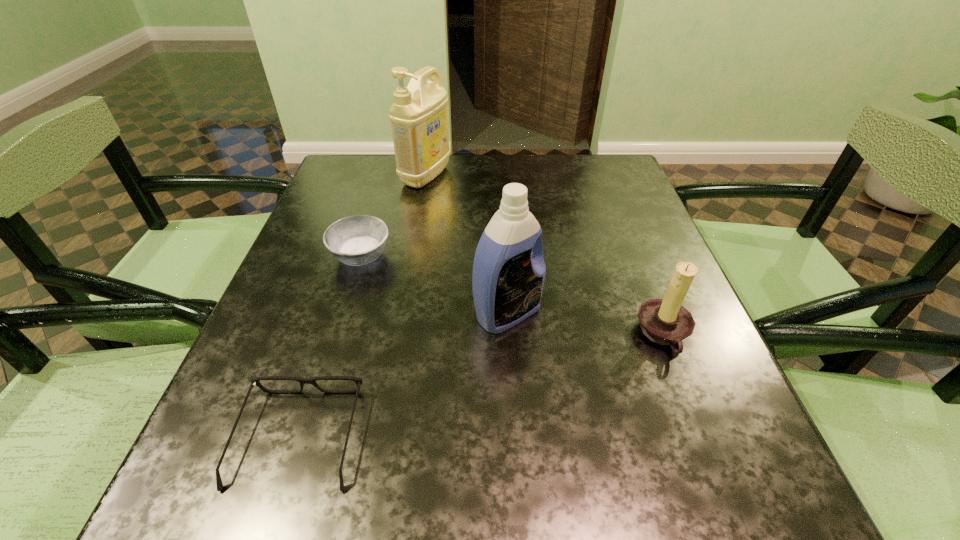
Identify the location of free spot located on the front of the farther detergent. The width and height of the screenshot is (960, 540). (404, 301).

Locate an element on the screen. The image size is (960, 540). free space located 0.070m on the front of the fourth object from left to right is located at coordinates (x=512, y=370).

Where is `vacant space located on the wick of the third tallest object`? This screenshot has width=960, height=540. vacant space located on the wick of the third tallest object is located at coordinates (604, 335).

Identify the location of vacant region located on the wick of the third tallest object. This screenshot has height=540, width=960. (412, 335).

Where is `free point located on the wick of the third tallest object`? This screenshot has width=960, height=540. free point located on the wick of the third tallest object is located at coordinates (559, 335).

You are a GUI agent. You are given a task and a screenshot of the screen. Output one action in this format:
    pyautogui.click(x=<x>, y=<y>)
    Task: Click on the free space located 0.310m on the front of the fourth tallest object
    
    Given the screenshot: What is the action you would take?
    pyautogui.click(x=312, y=416)

What are the coordinates of `free space located on the front-facing side of the shortest object` in the screenshot? It's located at (330, 337).

What are the coordinates of `free location located 0.380m on the front-facing side of the shortest object` in the screenshot? It's located at (361, 242).

What are the coordinates of `vacant space located 0.200m on the front-facing side of the shortest object` in the screenshot? It's located at (342, 300).

Locate an element on the screen. object that is at the far edge is located at coordinates (419, 115).